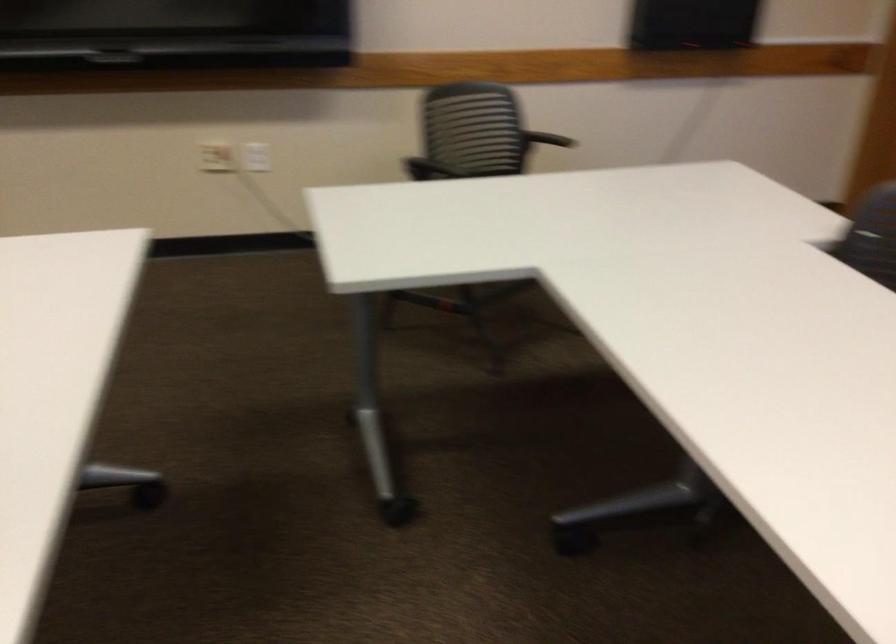
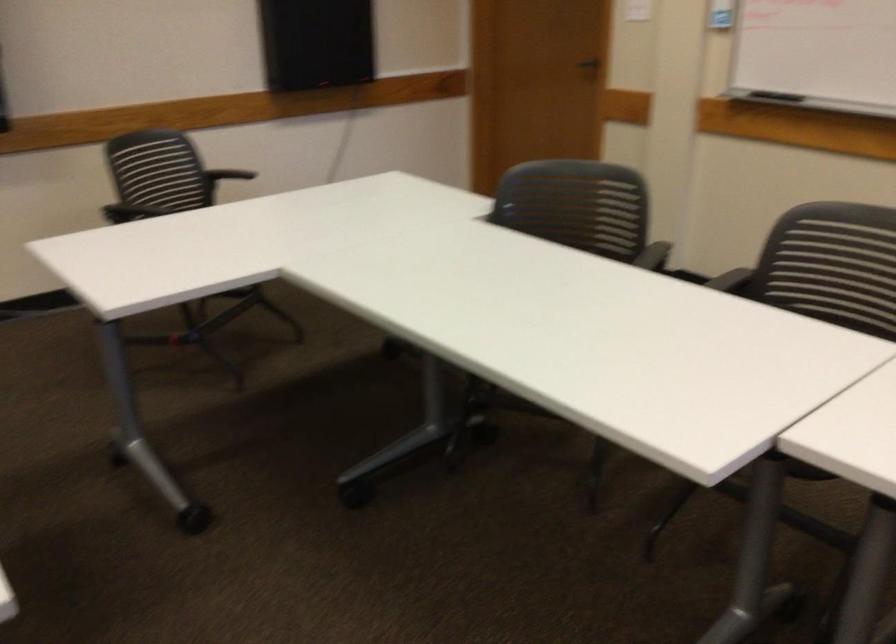
Question: How did the camera likely rotate?

Choices:
 (A) Left
 (B) Right
 (C) Up
 (D) Down

Answer: (B)